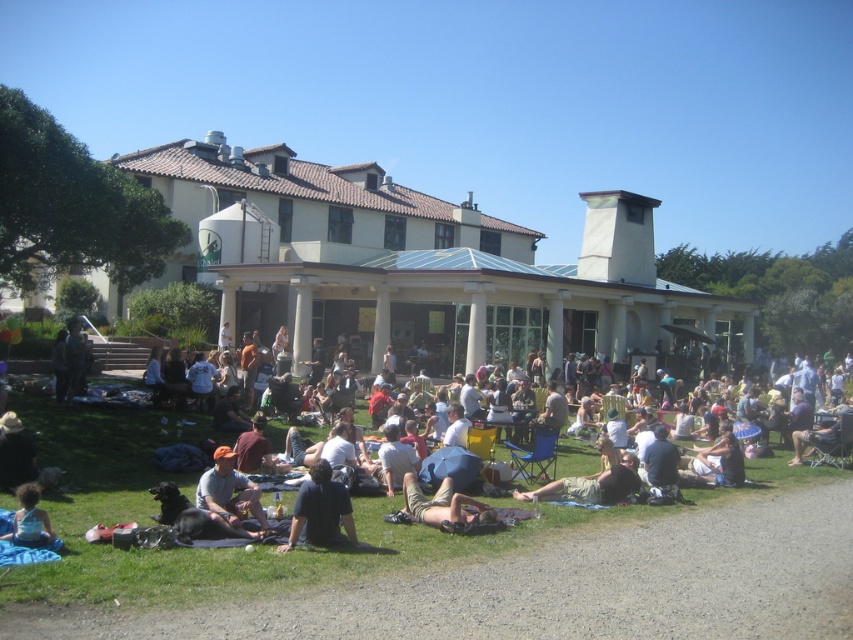
Is tan cotton shorts at lower center bigger than blue denim shorts at lower left?

Yes.

Is the position of tan cotton shorts at lower center more distant than that of blue denim shorts at lower left?

Yes, tan cotton shorts at lower center is further from the viewer.

Locate an element on the screen. The height and width of the screenshot is (640, 853). tan cotton shorts at lower center is located at coordinates (444, 504).

Which of these two, light brown fabric blanket at lower center or tan cotton shorts at lower center, stands shorter?

With less height is tan cotton shorts at lower center.

Who is more forward, (613, 470) or (434, 518)?

Positioned in front is point (434, 518).

Where is `light brown fabric blanket at lower center`? This screenshot has height=640, width=853. light brown fabric blanket at lower center is located at coordinates point(589,486).

At what (x,y) coordinates should I click in order to perform the action: click on light brown fabric blanket at lower center. Please return your answer as a coordinate pair (x, y). Looking at the image, I should click on (589, 486).

Which is more to the left, dark blue shirt at lower center or blue denim shorts at lower left?

Positioned to the left is blue denim shorts at lower left.

The height and width of the screenshot is (640, 853). What do you see at coordinates (321, 512) in the screenshot?
I see `dark blue shirt at lower center` at bounding box center [321, 512].

Does point (334, 500) come in front of point (51, 531)?

No, it is behind (51, 531).

Where is `dark blue shirt at lower center`? Image resolution: width=853 pixels, height=640 pixels. dark blue shirt at lower center is located at coordinates (321, 512).